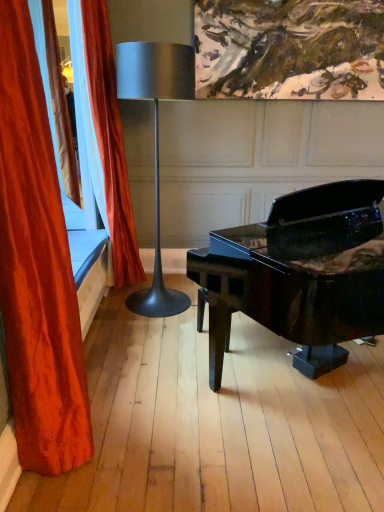
This screenshot has height=512, width=384. I want to click on unoccupied space behind velvet red curtain at left, the 1th curtain positioned from the front, so click(x=115, y=385).